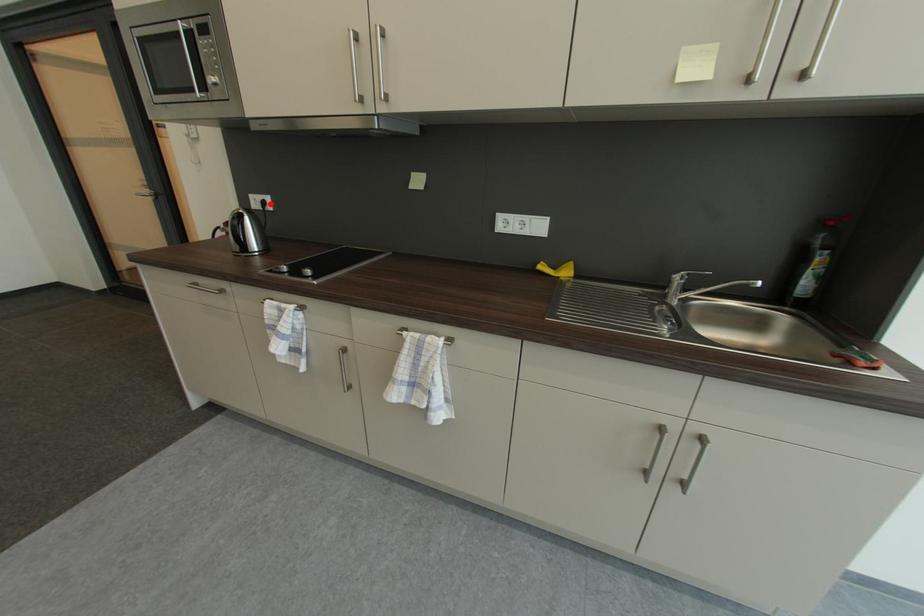
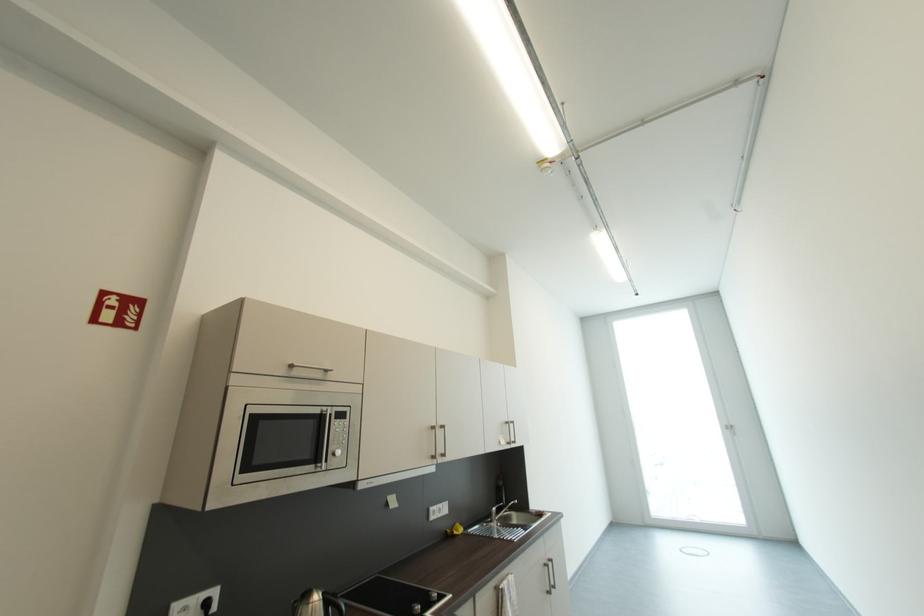
Where in the second image is the point corresponding to the highlighted location from the first image?

(213, 605)